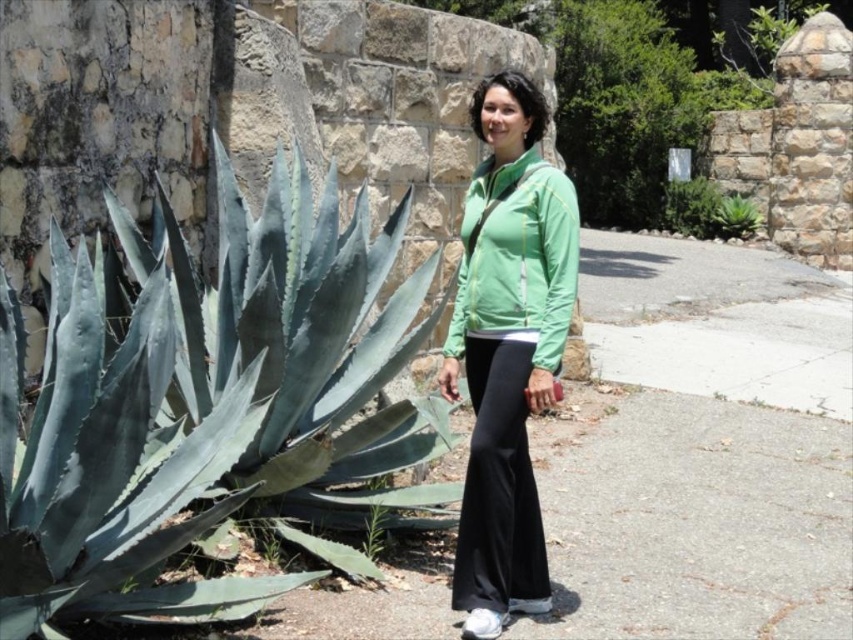
Question: Does green succulent at left have a greater width compared to green leafy plant at center?

Choices:
 (A) yes
 (B) no

Answer: (A)

Question: Which of the following is the farthest from the observer?

Choices:
 (A) green leafy plant at center
 (B) green fabric jacket at center
 (C) green succulent at left

Answer: (A)

Question: Which of the following is the closest to the observer?

Choices:
 (A) green leafy plant at center
 (B) green succulent at left
 (C) black cotton pants at center

Answer: (B)

Question: Is black cotton pants at center further to camera compared to green succulent at center?

Choices:
 (A) no
 (B) yes

Answer: (A)

Question: Is green fabric jacket at center to the right of black cotton pants at center from the viewer's perspective?

Choices:
 (A) no
 (B) yes

Answer: (B)

Question: Which point appears closest to the camera in this image?

Choices:
 (A) (506, 372)
 (B) (730, 220)
 (C) (486, 584)

Answer: (A)